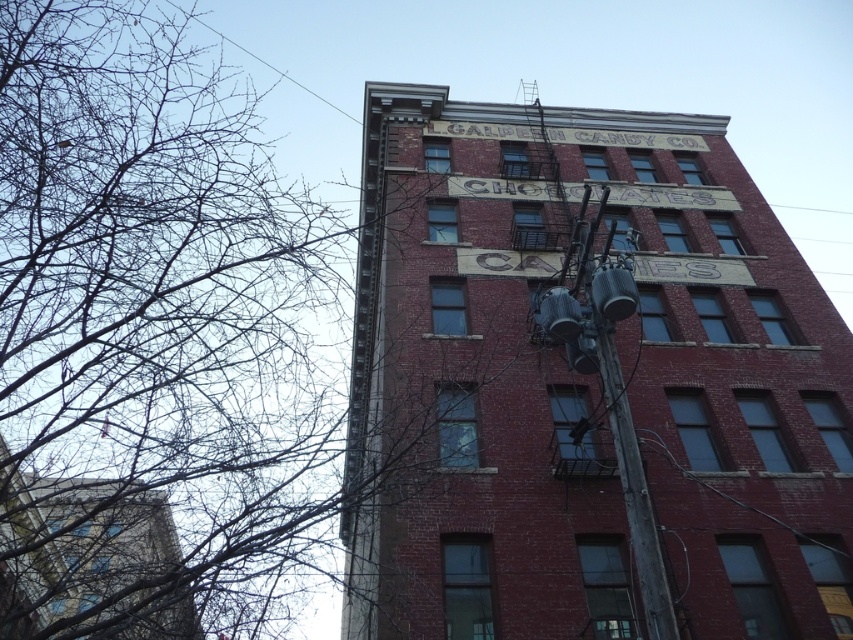
Which is more to the right, red brick building at upper center or bare branches at upper left?

red brick building at upper center is more to the right.

Does red brick building at upper center have a lesser width compared to bare branches at upper left?

Yes, red brick building at upper center is thinner than bare branches at upper left.

At what (x,y) coordinates should I click in order to perform the action: click on red brick building at upper center. Please return your answer as a coordinate pair (x, y). Looking at the image, I should click on (583, 385).

Image resolution: width=853 pixels, height=640 pixels. Find the location of `red brick building at upper center`. red brick building at upper center is located at coordinates (583, 385).